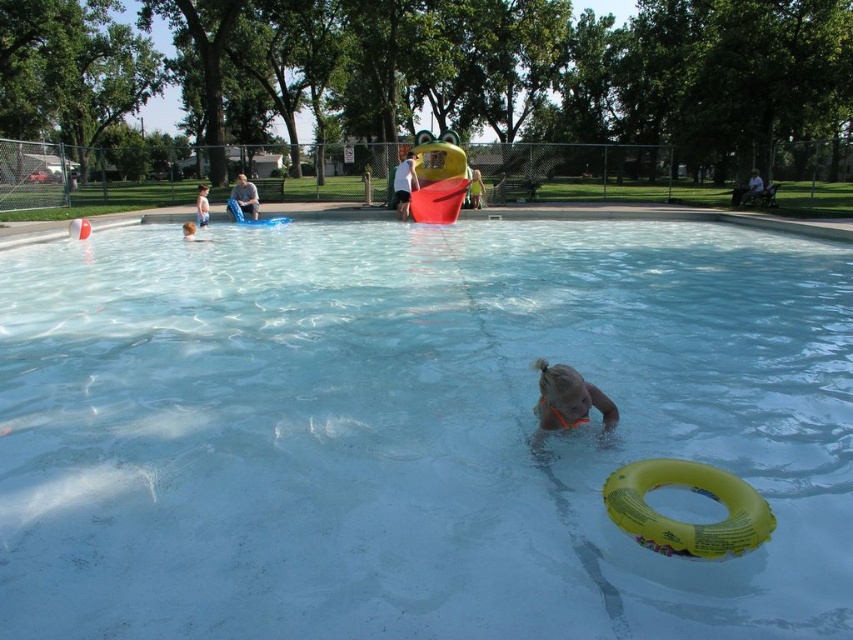
Question: Considering the relative positions of blue denim shorts at upper left and yellow rubber ring at lower right in the image provided, where is blue denim shorts at upper left located with respect to yellow rubber ring at lower right?

Choices:
 (A) below
 (B) above

Answer: (B)

Question: Does orange rubber ring at center lie behind light blue fabric towel at upper left?

Choices:
 (A) yes
 (B) no

Answer: (B)

Question: Which object is farther from the camera taking this photo?

Choices:
 (A) light brown wooden bench at upper center
 (B) light blue swim trunks at upper left

Answer: (A)

Question: Which object is farther from the camera taking this photo?

Choices:
 (A) clear plastic pool at center
 (B) blue denim shorts at upper left

Answer: (B)

Question: Which point appears farthest from the camera in this image?

Choices:
 (A) (201, 221)
 (B) (409, 202)

Answer: (B)

Question: Where is blue denim shorts at upper left located in relation to light brown wooden bench at upper center in the image?

Choices:
 (A) above
 (B) below

Answer: (B)